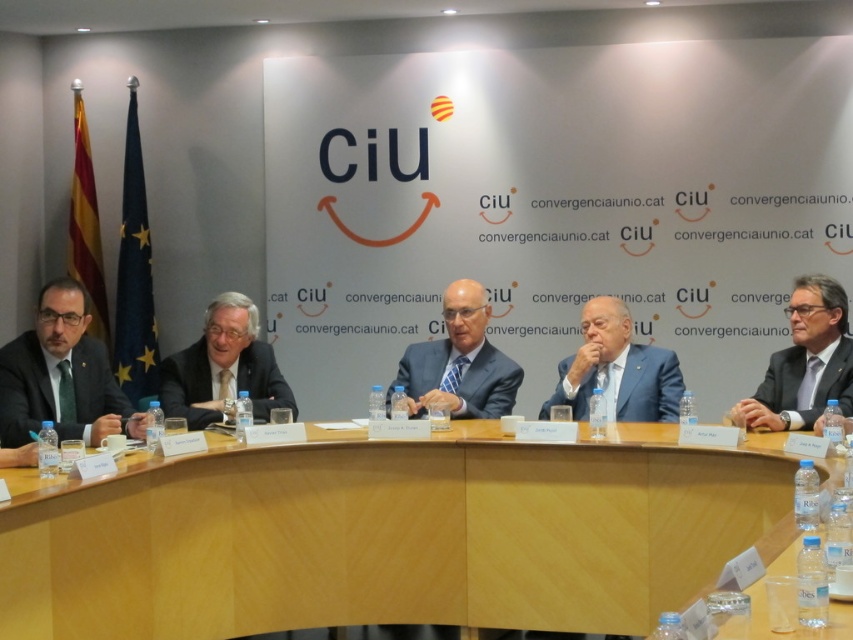
You are organizing a photo shoot for a professional event. You need to place two suits in the scene described. The matte black suit at left and the blue suit at center must be positioned so that they are visible but not overlapping. Given their sizes, which suit should be placed closer to the camera to ensure both are clearly visible?

The matte black suit at left, which is smaller in size, should be placed closer to the camera than the blue suit at center. This ensures both suits are clearly visible without overlapping, as the smaller suit needs to be nearer to maintain its visibility compared to the larger blue suit.

You are a photographer taking a picture of the meeting setup. You need to position your camera so that both the point at (x=103, y=371) and the point at (x=230, y=355) are visible. Which point should you ensure is closer to the camera to avoid it being blocked by the other?

Point (x=103, y=371) is in front of point (x=230, y=355), so you should ensure that point (x=103, y=371) is closer to the camera to avoid it being blocked by the other point.

You are attending a virtual meeting and need to identify the person wearing the matte black suit at left. Based on their position relative to the banner, where would they be seated in relation to the CiU banner?

The matte black suit at left is located at point (61, 376), which places them to the left side of the CiU banner in the image.